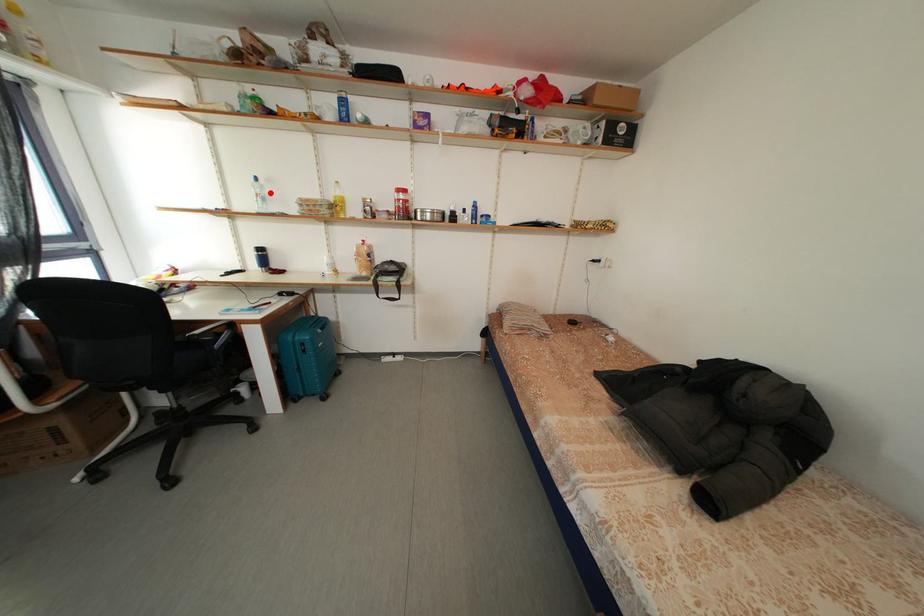
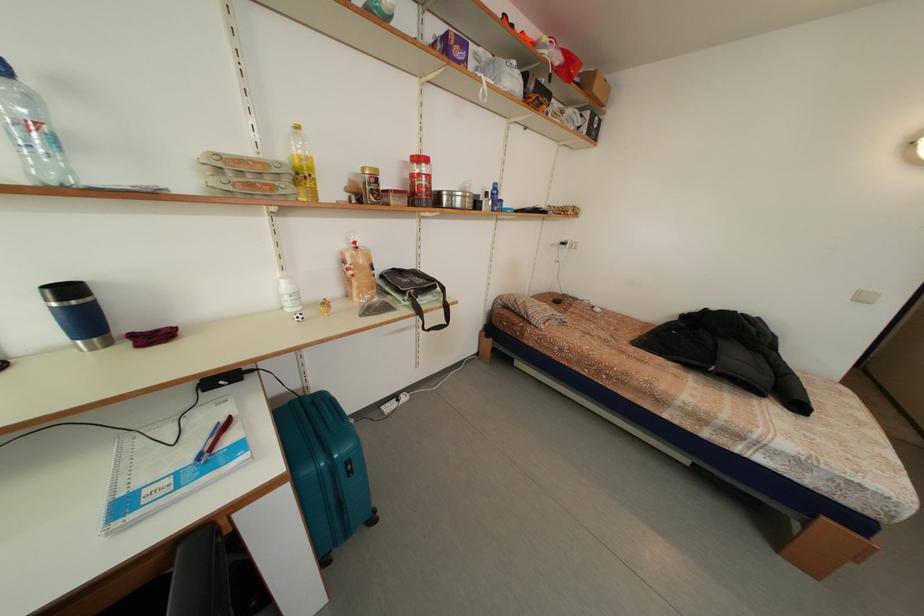
Find the pixel in the second image that matches the highlighted location in the first image.

(40, 106)